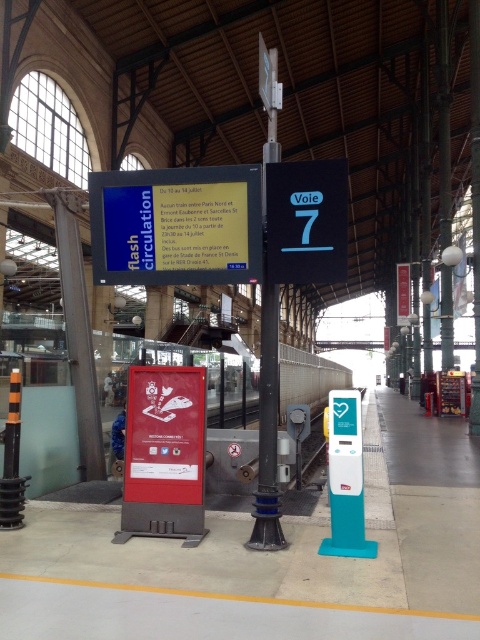
Looking at this image, which of these two, black plastic sign at center or metallic pole at center, stands shorter?

With less height is black plastic sign at center.

Is black plastic sign at center closer to the viewer compared to metallic pole at center?

Yes.

Find the location of a particular element. The height and width of the screenshot is (640, 480). black plastic sign at center is located at coordinates (307, 221).

Who is positioned more to the left, blue glossy signboard at center or black plastic sign at center?

blue glossy signboard at center is more to the left.

Can you confirm if blue glossy signboard at center is positioned below black plastic sign at center?

Yes, blue glossy signboard at center is below black plastic sign at center.

Is point (230, 225) closer to viewer compared to point (300, 214)?

That is False.

Image resolution: width=480 pixels, height=640 pixels. In order to click on blue glossy signboard at center in this screenshot , I will do `click(177, 225)`.

Between metallic pole at center and metallic glass pillar at left, which one has less height?

With less height is metallic glass pillar at left.

The width and height of the screenshot is (480, 640). I want to click on metallic pole at center, so click(267, 426).